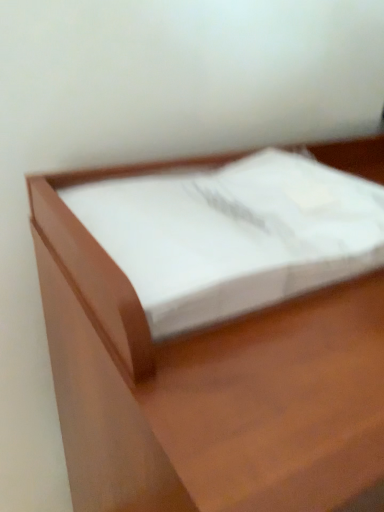
Question: Should I look upward or downward to see matte wood tissue box at center?

Choices:
 (A) up
 (B) down

Answer: (B)